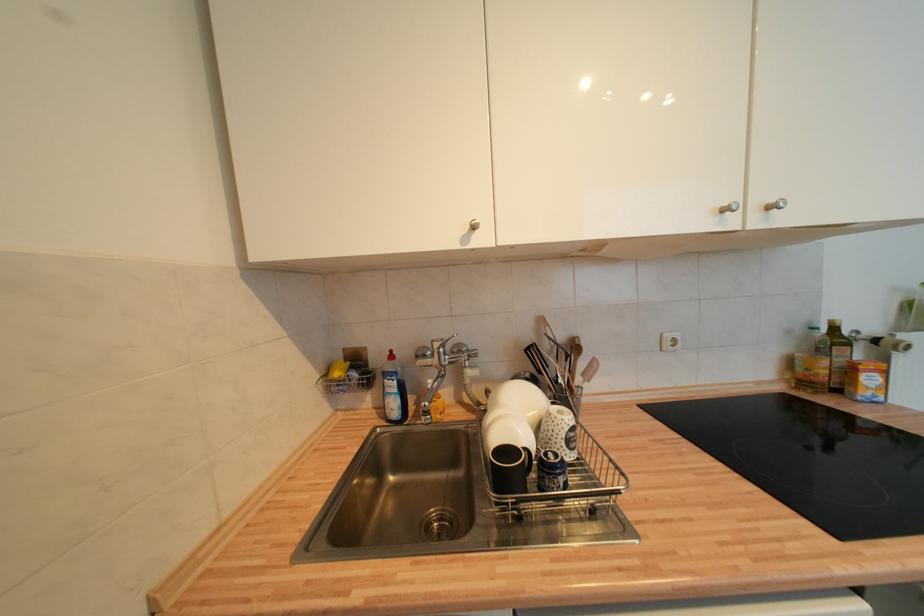
The location [721,476] corresponds to which object?

It corresponds to the patterned white mug in the image.